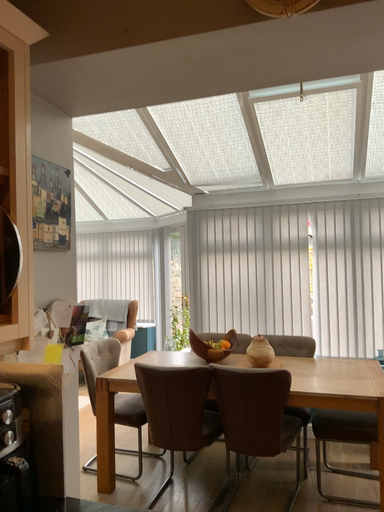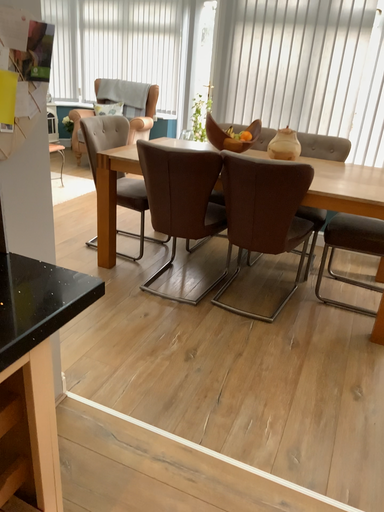
Question: Which way did the camera rotate in the video?

Choices:
 (A) rotated downward
 (B) rotated upward

Answer: (A)